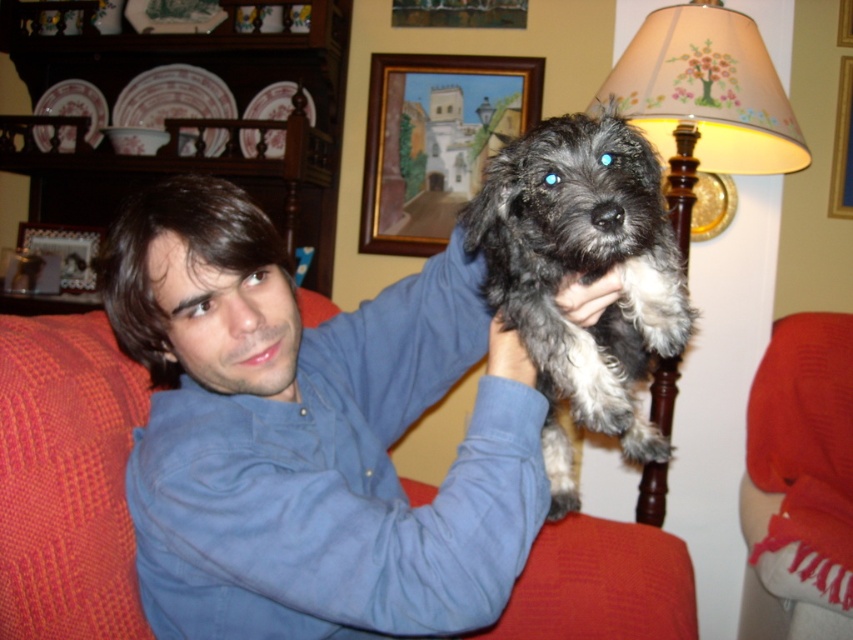
You are a photographer adjusting your camera settings. You notice the shaggy gray fur at center and the matte beige lampshade at upper right. Which object should you focus on to ensure sharpness if you want to prioritize the closer subject?

You should focus on the shaggy gray fur at center because it is closer to the viewer than the matte beige lampshade at upper right, so focusing on it will ensure the closer subject is sharp.

You are a photographer trying to capture a closeup of the wooden framed painting at upper center without the shaggy gray fur at center blocking the view. Can you adjust your position to do so?

The shaggy gray fur at center is thinner than the wooden framed painting at upper center, so if you move your camera position slightly to the side, you can capture the wooden framed painting at upper center without obstruction from the shaggy gray fur at center.